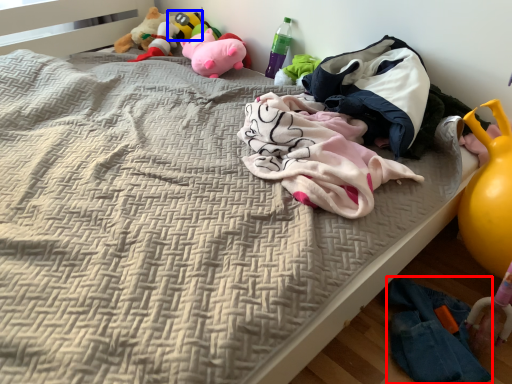
Question: Which object appears farthest to the camera in this image, clothing (highlighted by a red box) or toy (highlighted by a blue box)?

Choices:
 (A) clothing
 (B) toy

Answer: (B)